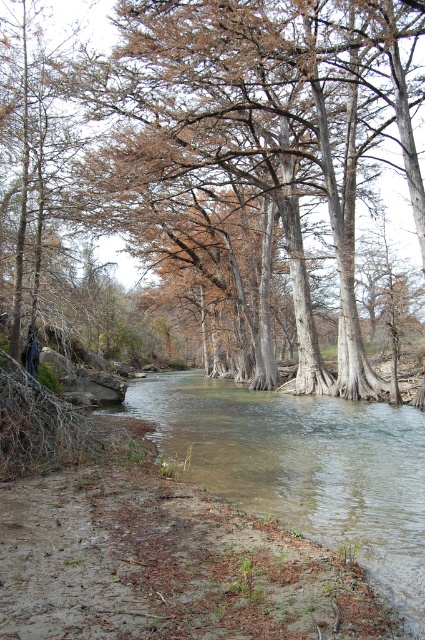
You are a kayaker planning to navigate the river shown in the image. You need to know the distance between the brown wood tree at center and the clear water at center to ensure safe passage. Is the distance sufficient for your kayak, which requires at least 50 feet of clearance between obstacles?

The distance between the brown wood tree at center and the clear water at center is 47.54 feet, which is less than the required 50 feet clearance. Therefore, the distance is insufficient for safe passage with your kayak.

You are standing at the edge of the river and want to reach the clear water at center without stepping on the brown wood tree at center. Is this possible?

The brown wood tree at center is further to the viewer than clear water at center, so you can reach the clear water at center without stepping on the brown wood tree at center by moving around it.